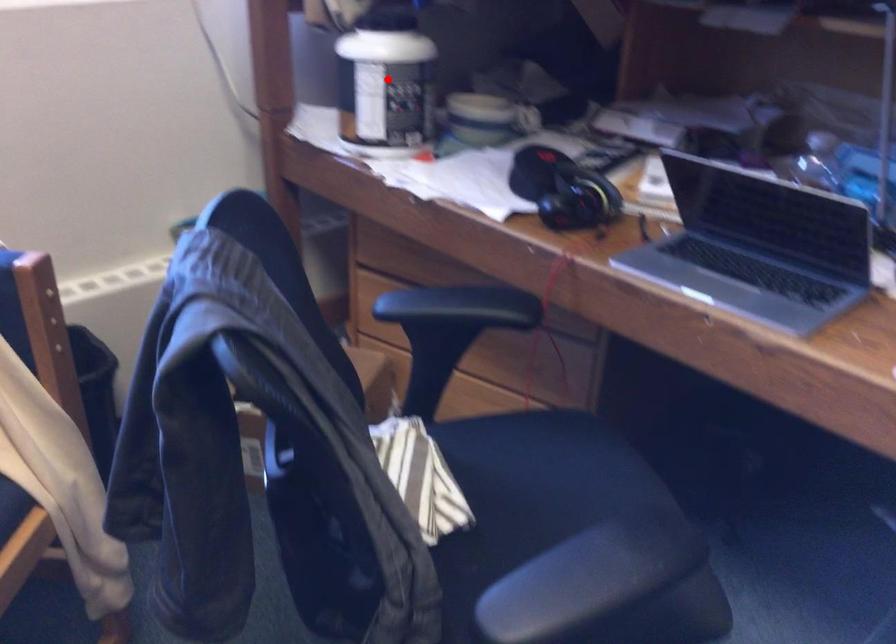
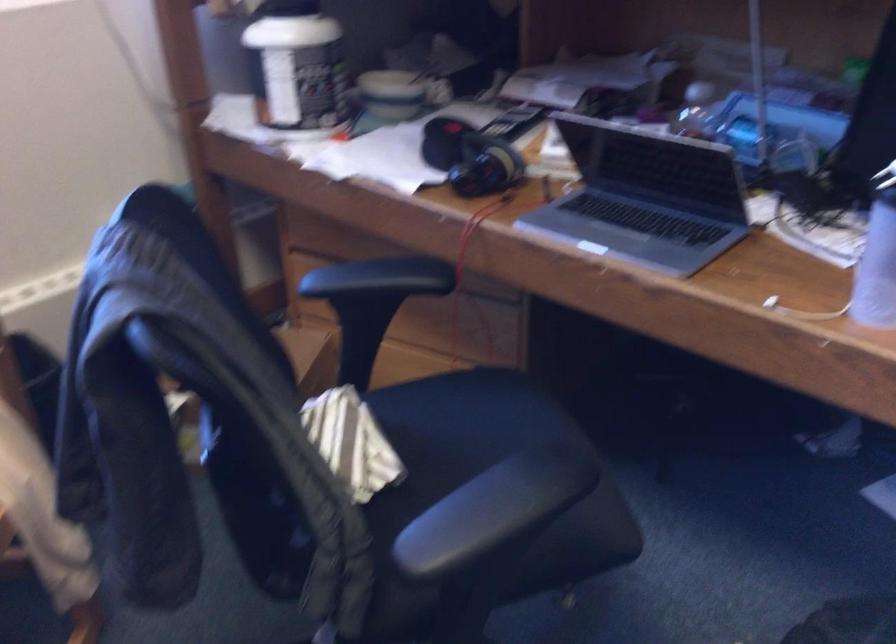
Find the pixel in the second image that matches the highlighted location in the first image.

(297, 67)